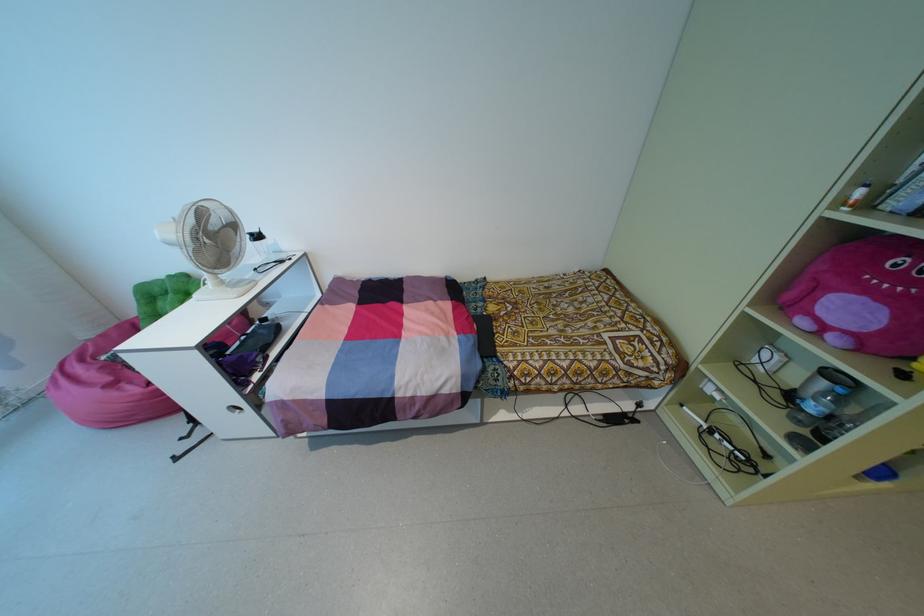
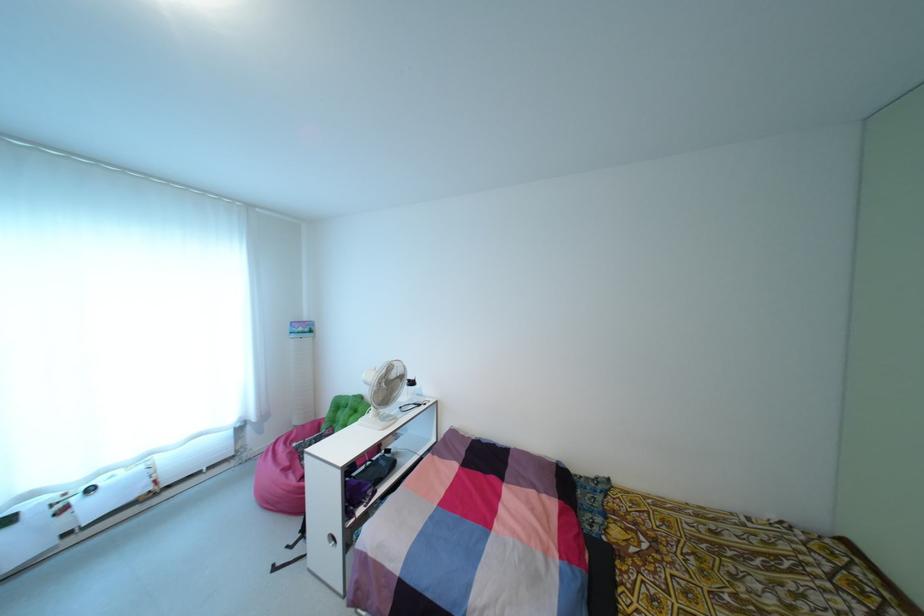
Find the pixel in the second image that matches point (108, 378) in the first image.

(286, 463)